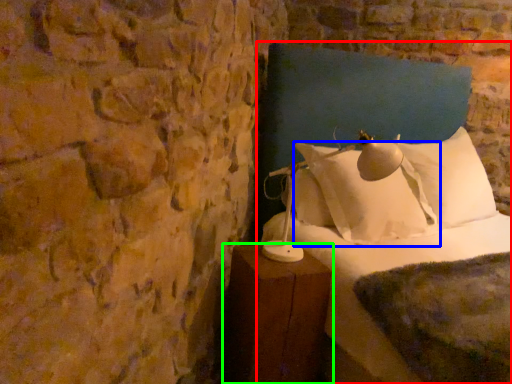
Question: Considering the real-world distances, which object is closest to bed (highlighted by a red box)? pillow (highlighted by a blue box) or furniture (highlighted by a green box).

Choices:
 (A) pillow
 (B) furniture

Answer: (A)